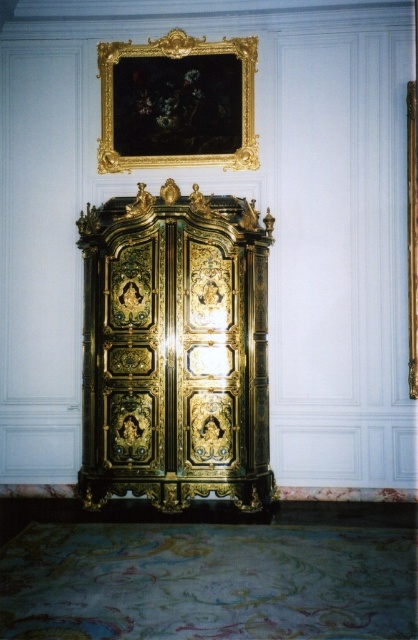
Question: Which point appears closest to the camera in this image?

Choices:
 (A) (216, 145)
 (B) (124, 292)

Answer: (B)

Question: Can you confirm if gold polished wood dresser at center is positioned to the left of gold ornate frame at upper center?

Choices:
 (A) no
 (B) yes

Answer: (A)

Question: Can you confirm if gold polished wood dresser at center is wider than gold ornate frame at upper center?

Choices:
 (A) no
 (B) yes

Answer: (B)

Question: Can you confirm if gold polished wood dresser at center is bigger than gold ornate frame at upper center?

Choices:
 (A) no
 (B) yes

Answer: (B)

Question: Which point is closer to the camera?

Choices:
 (A) gold polished wood dresser at center
 (B) gold ornate frame at upper center

Answer: (A)